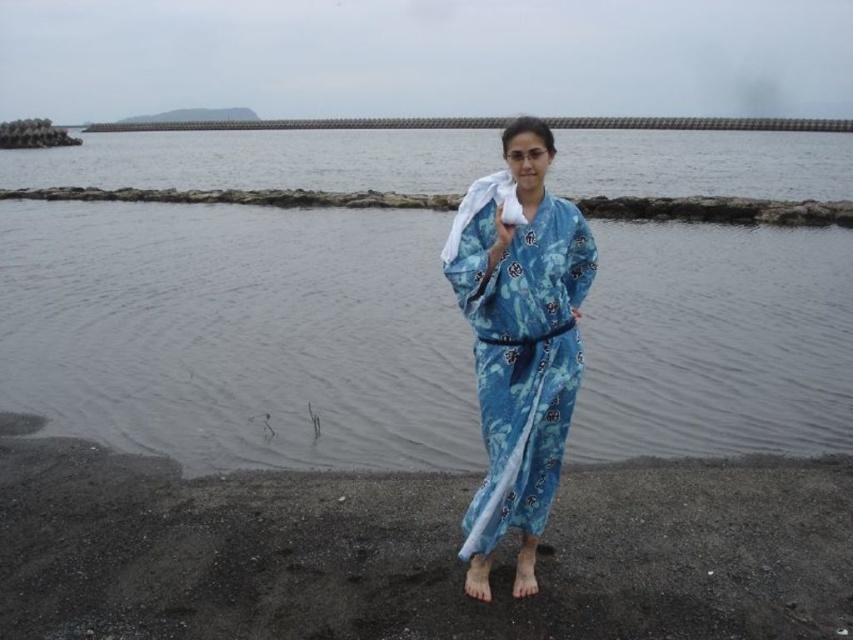
You are standing at the edge of a body of water and want to place a small object on the black sand at lower center. If you can throw the object 4 meters, will it land on the sand?

The black sand at lower center is 4.13 meters away from the viewer. Since you can only throw 4 meters, the object will fall short and not land on the sand.

You are standing at the point marked by point (x=236, y=332) in the image. What is directly beneath your feet?

The point (x=236, y=332) marks clear water at center, so the clear water at center is directly beneath your feet.

You are a visitor at a beach and want to place your towel on the dry area. Based on the image, which area should you choose between the clear water at center and the black sand at lower center?

The black sand at lower center is the dry area since the clear water at center is above it, meaning the black sand is not submerged.